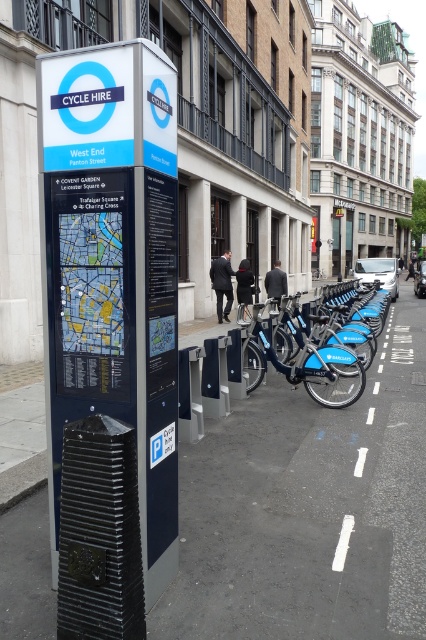
You are standing in front of the Cycle Hire signpost on Panton Street. Looking at the map on the sign, you notice a point marked at coordinates (308, 509). What does this point represent?

The point at coordinates (308, 509) indicates the black rubber pavement at lower center on the map.

You are a tourist in London and see the metallic blue sign at center and the blue metallic bicycle at center. Which object is positioned to the left?

The metallic blue sign at center is positioned to the left of the blue metallic bicycle at center.